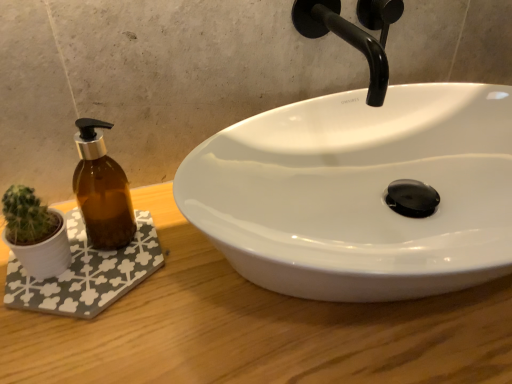
Question: From a real-world perspective, is black matte faucet at upper center below white fabric bath mat at lower left?

Choices:
 (A) no
 (B) yes

Answer: (A)

Question: Is black matte faucet at upper center positioned with its back to white fabric bath mat at lower left?

Choices:
 (A) yes
 (B) no

Answer: (B)

Question: Does black matte faucet at upper center have a lesser width compared to white fabric bath mat at lower left?

Choices:
 (A) no
 (B) yes

Answer: (A)

Question: Is black matte faucet at upper center in front of white fabric bath mat at lower left?

Choices:
 (A) yes
 (B) no

Answer: (A)

Question: From the image's perspective, does black matte faucet at upper center appear lower than white fabric bath mat at lower left?

Choices:
 (A) no
 (B) yes

Answer: (A)

Question: Can you confirm if black matte faucet at upper center is positioned to the left of white fabric bath mat at lower left?

Choices:
 (A) yes
 (B) no

Answer: (B)

Question: Is white fabric bath mat at lower left bigger than black matte faucet at upper center?

Choices:
 (A) no
 (B) yes

Answer: (A)

Question: Would you say white fabric bath mat at lower left contains black matte faucet at upper center?

Choices:
 (A) no
 (B) yes

Answer: (A)

Question: Is white fabric bath mat at lower left in contact with black matte faucet at upper center?

Choices:
 (A) yes
 (B) no

Answer: (B)

Question: Could you tell me if white fabric bath mat at lower left is facing black matte faucet at upper center?

Choices:
 (A) no
 (B) yes

Answer: (A)

Question: From a real-world perspective, is white fabric bath mat at lower left located higher than black matte faucet at upper center?

Choices:
 (A) no
 (B) yes

Answer: (A)

Question: Is white fabric bath mat at lower left shorter than black matte faucet at upper center?

Choices:
 (A) no
 (B) yes

Answer: (B)

Question: Is white glossy sink at center to the right of white fabric bath mat at lower left from the viewer's perspective?

Choices:
 (A) yes
 (B) no

Answer: (A)